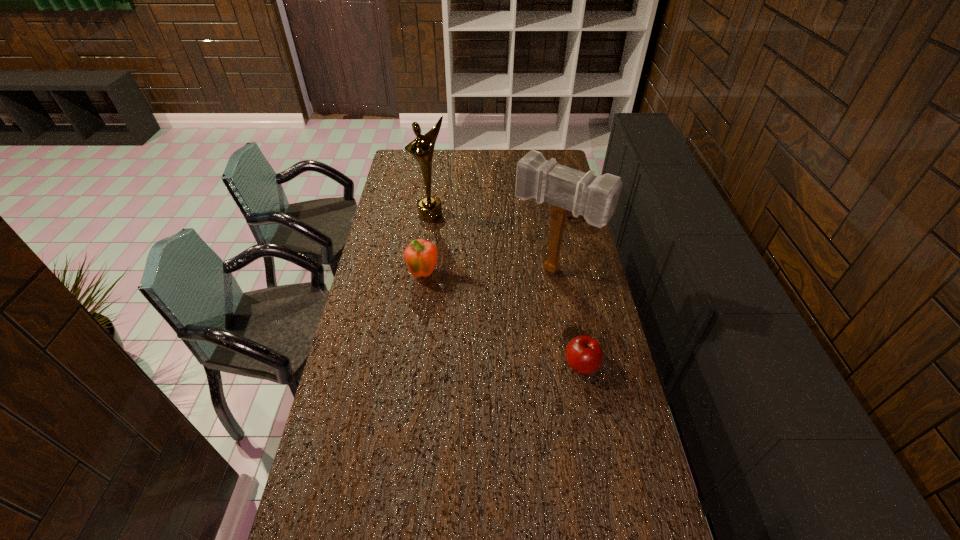
In order to click on empty space between the nearest object and the mallet in this screenshot , I will do `click(567, 318)`.

Find the location of a particular element. This screenshot has height=540, width=960. free spot between the apple and the mallet is located at coordinates (567, 318).

The height and width of the screenshot is (540, 960). In order to click on empty space between the mallet and the award in this screenshot , I will do `click(492, 242)`.

Identify which object is the fourth nearest to the mallet. Please provide its 2D coordinates. Your answer should be formatted as a tuple, i.e. [(x, y)], where the tuple contains the x and y coordinates of a point satisfying the conditions above.

[(421, 148)]

Locate an element on the screen. object that can be found as the fourth closest to the mallet is located at coordinates (421, 148).

The image size is (960, 540). I want to click on free space in the image that satisfies the following two spatial constraints: 1. on the back side of the second shortest object; 2. on the right side of the mallet, so click(x=543, y=214).

The image size is (960, 540). I want to click on free space that satisfies the following two spatial constraints: 1. on the front side of the nearest object; 2. on the left side of the award, so click(x=412, y=364).